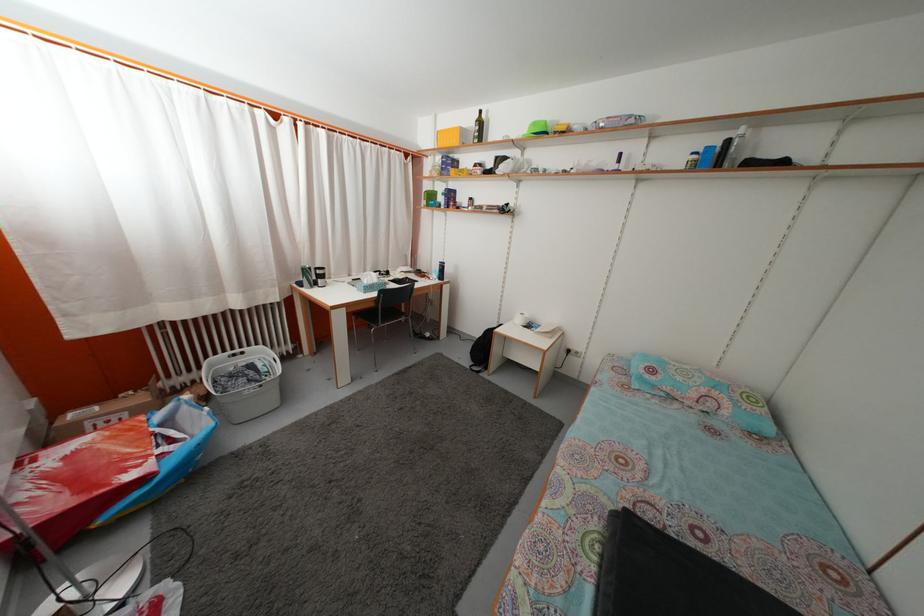
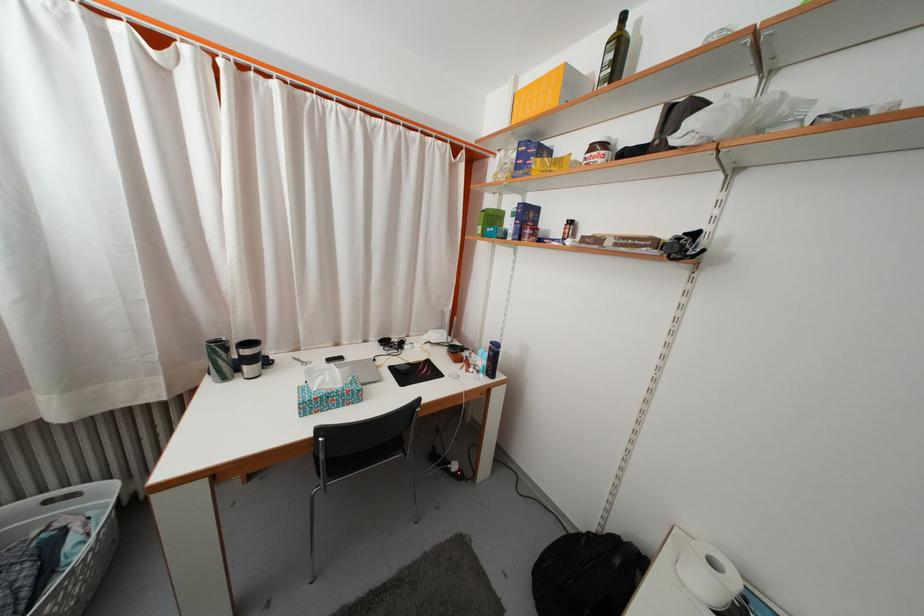
In the second image, find the point that corresponds to point 485,131 in the first image.

(625, 54)